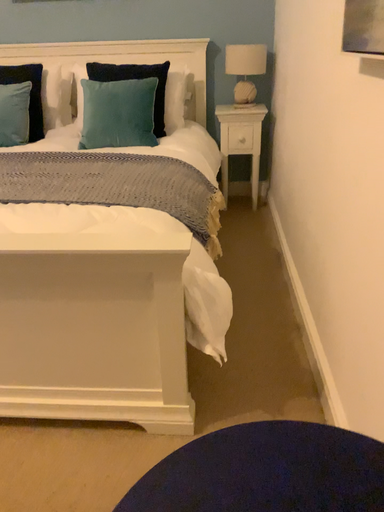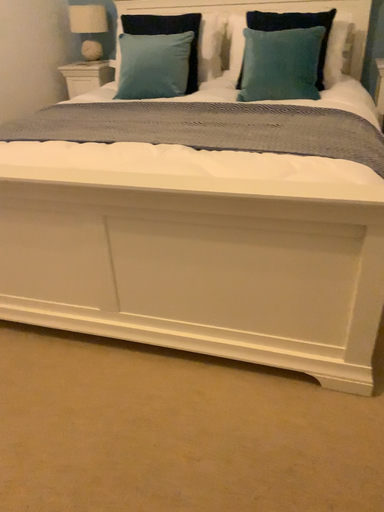
Question: How did the camera likely rotate when shooting the video?

Choices:
 (A) rotated left
 (B) rotated right

Answer: (A)